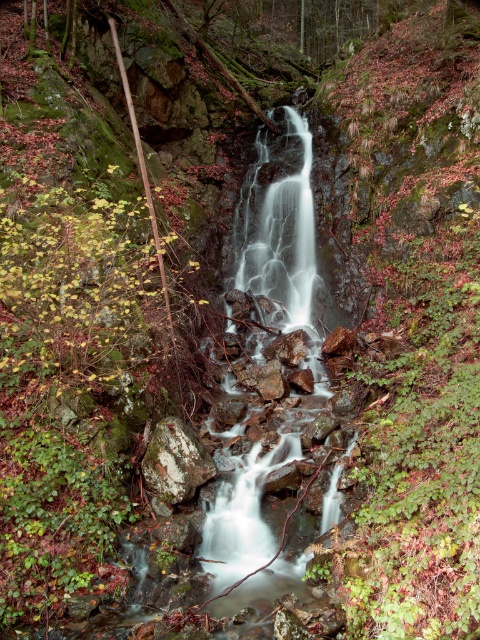
Can you confirm if white smooth water at center is positioned to the right of speckled rock at center?

Yes, white smooth water at center is to the right of speckled rock at center.

Can you confirm if white smooth water at center is positioned below speckled rock at center?

No, white smooth water at center is not below speckled rock at center.

Who is more distant from viewer, (315, 388) or (189, 497)?

The point (315, 388) is behind.

The width and height of the screenshot is (480, 640). Find the location of `white smooth water at center`. white smooth water at center is located at coordinates (274, 365).